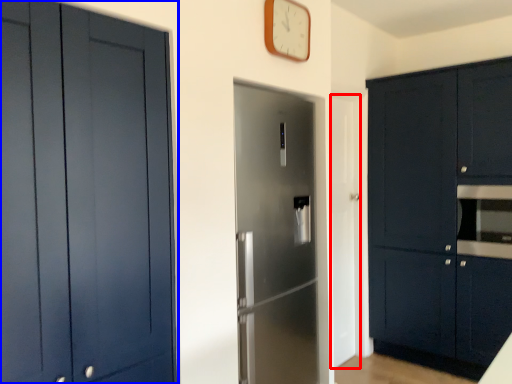
Question: Which object is further to the camera taking this photo, door (highlighted by a red box) or cabinetry (highlighted by a blue box)?

Choices:
 (A) door
 (B) cabinetry

Answer: (A)